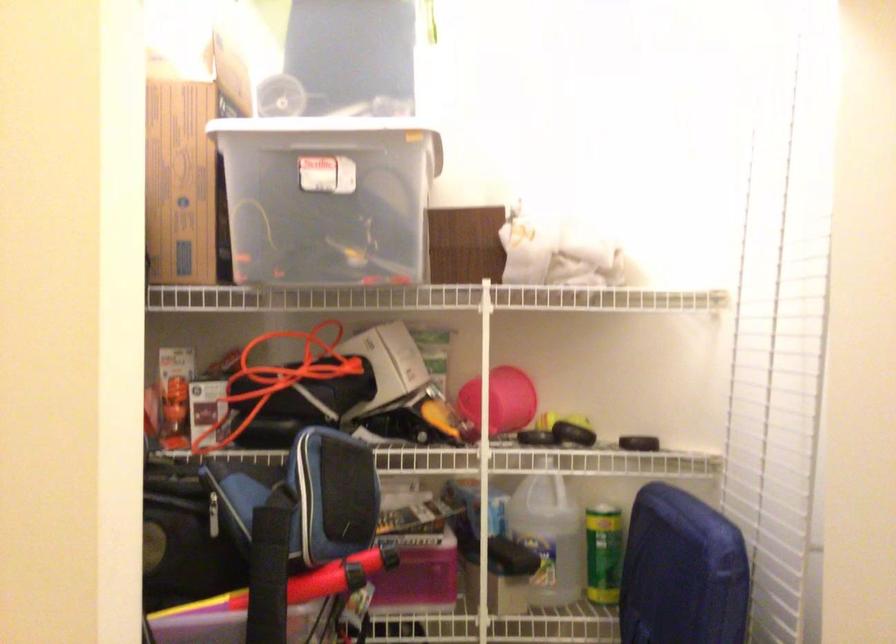
Where is `pink plastic bowl`? pink plastic bowl is located at coordinates (500, 401).